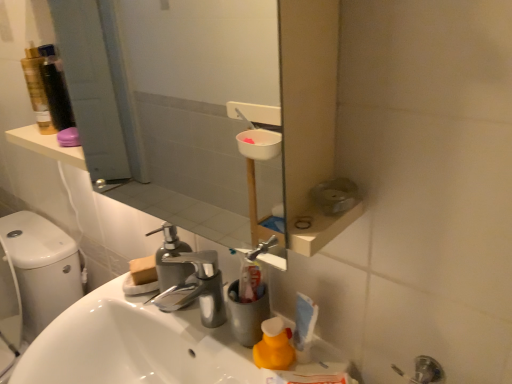
What do you see at coordinates (196, 287) in the screenshot? I see `chrome metallic faucet at center` at bounding box center [196, 287].

This screenshot has width=512, height=384. What do you see at coordinates (274, 346) in the screenshot?
I see `yellow matte cleaning product at lower center` at bounding box center [274, 346].

In order to click on chrome metallic faucet at center in this screenshot , I will do 196,287.

Does chrome metallic faucet at center lie behind white glossy sink at center?

Yes, the depth of chrome metallic faucet at center is greater than that of white glossy sink at center.

Is chrome metallic faucet at center not within white glossy sink at center?

Absolutely, chrome metallic faucet at center is external to white glossy sink at center.

You are a GUI agent. You are given a task and a screenshot of the screen. Output one action in this format:
    pyautogui.click(x=<x>, y=<y>)
    Task: Click on the tap lying above the white glossy sink at center (from the image's perspective)
    Image resolution: width=512 pixels, height=384 pixels.
    Given the screenshot: What is the action you would take?
    pyautogui.click(x=196, y=287)

Does white glossy sink at center touch chrome metallic faucet at center?

No, white glossy sink at center is not beside chrome metallic faucet at center.

Considering the positions of point (45, 382) and point (167, 299), is point (45, 382) closer or farther from the camera than point (167, 299)?

Point (45, 382) appears to be closer to the viewer than point (167, 299).

Is white glossy sink at center facing towards chrome metallic faucet at center?

No, white glossy sink at center is not facing towards chrome metallic faucet at center.

Which of these two, clear glass mirror at upper center or yellow matte cleaning product at lower center, is smaller?

With smaller size is yellow matte cleaning product at lower center.

Is point (80, 52) closer or farther from the camera than point (287, 333)?

Point (80, 52) is farther from the camera than point (287, 333).

Is clear glass mirror at upper center not within yellow matte cleaning product at lower center?

clear glass mirror at upper center lies outside yellow matte cleaning product at lower center's area.

From the image's perspective, which is below, clear glass mirror at upper center or yellow matte cleaning product at lower center?

yellow matte cleaning product at lower center.

Which object is thinner, yellow matte cleaning product at lower center or clear glass mirror at upper center?

Thinner between the two is yellow matte cleaning product at lower center.

Is yellow matte cleaning product at lower center facing away from clear glass mirror at upper center?

No, yellow matte cleaning product at lower center is not facing away from clear glass mirror at upper center.

In the scene shown: What's the angular difference between yellow matte cleaning product at lower center and clear glass mirror at upper center's facing directions?

They differ by 2.49 degrees in their facing directions.

Based on the photo, considering the sizes of objects yellow matte cleaning product at lower center and chrome metallic faucet at center in the image provided, who is smaller, yellow matte cleaning product at lower center or chrome metallic faucet at center?

yellow matte cleaning product at lower center is smaller.

Is yellow matte cleaning product at lower center turned away from chrome metallic faucet at center?

No, yellow matte cleaning product at lower center is not facing the opposite direction of chrome metallic faucet at center.

From a real-world perspective, is yellow matte cleaning product at lower center physically above chrome metallic faucet at center?

No, from a real-world perspective, yellow matte cleaning product at lower center is not on top of chrome metallic faucet at center.

Is chrome metallic faucet at center closer to camera compared to clear glass mirror at upper center?

No.

Where is `tap below the clear glass mirror at upper center (from a real-world perspective)`? This screenshot has width=512, height=384. tap below the clear glass mirror at upper center (from a real-world perspective) is located at coordinates (196, 287).

Considering the relative sizes of chrome metallic faucet at center and clear glass mirror at upper center in the image provided, is chrome metallic faucet at center smaller than clear glass mirror at upper center?

Correct, chrome metallic faucet at center occupies less space than clear glass mirror at upper center.

Choose the correct answer: Is white glossy sink at center inside yellow matte cleaning product at lower center or outside it?

white glossy sink at center is not enclosed by yellow matte cleaning product at lower center.

Between white glossy sink at center and yellow matte cleaning product at lower center, which one is positioned behind?

yellow matte cleaning product at lower center.

Can you tell me how much white glossy sink at center and yellow matte cleaning product at lower center differ in facing direction?

white glossy sink at center and yellow matte cleaning product at lower center are facing 3.47 degrees away from each other.

From the image's perspective, is white glossy sink at center located above yellow matte cleaning product at lower center?

No, from the image's perspective, white glossy sink at center is not on top of yellow matte cleaning product at lower center.

Image resolution: width=512 pixels, height=384 pixels. I want to click on sink that appears below the chrome metallic faucet at center (from a real-world perspective), so click(x=133, y=345).

Locate an element on the screen. sink lying in front of the chrome metallic faucet at center is located at coordinates (133, 345).

Based on their spatial positions, is yellow matte cleaning product at lower center or chrome metallic faucet at center further from white glossy sink at center?

The object further to white glossy sink at center is yellow matte cleaning product at lower center.

Based on their spatial positions, is chrome metallic faucet at center or yellow matte cleaning product at lower center further from clear glass mirror at upper center?

yellow matte cleaning product at lower center is further to clear glass mirror at upper center.

Which object lies nearer to the anchor point chrome metallic faucet at center, clear glass mirror at upper center or yellow matte cleaning product at lower center?

Based on the image, yellow matte cleaning product at lower center appears to be nearer to chrome metallic faucet at center.

Estimate the real-world distances between objects in this image. Which object is closer to clear glass mirror at upper center, yellow matte cleaning product at lower center or white glossy sink at center?

Based on the image, white glossy sink at center appears to be nearer to clear glass mirror at upper center.

Based on their spatial positions, is yellow matte cleaning product at lower center or clear glass mirror at upper center further from white glossy sink at center?

Among the two, clear glass mirror at upper center is located further to white glossy sink at center.

Looking at the image, which one is located further to clear glass mirror at upper center, yellow matte cleaning product at lower center or chrome metallic faucet at center?

The object further to clear glass mirror at upper center is yellow matte cleaning product at lower center.

Based on the photo, based on their spatial positions, is clear glass mirror at upper center or chrome metallic faucet at center further from white glossy sink at center?

clear glass mirror at upper center.

Based on their spatial positions, is white glossy sink at center or chrome metallic faucet at center closer to clear glass mirror at upper center?

Among the two, white glossy sink at center is located nearer to clear glass mirror at upper center.

You are a GUI agent. You are given a task and a screenshot of the screen. Output one action in this format:
    pyautogui.click(x=<x>, y=<y>)
    Task: Click on the cleaning product between clear glass mirror at upper center and white glossy sink at center from top to bottom
    The width and height of the screenshot is (512, 384).
    Given the screenshot: What is the action you would take?
    pyautogui.click(x=274, y=346)

Where is `cleaning product located between white glossy sink at center and chrome metallic faucet at center in the depth direction`? cleaning product located between white glossy sink at center and chrome metallic faucet at center in the depth direction is located at coordinates (274, 346).

Find the location of a particular element. tap between clear glass mirror at upper center and white glossy sink at center in the up-down direction is located at coordinates (196, 287).

Where is `tap between clear glass mirror at upper center and yellow matte cleaning product at lower center in the up-down direction`? tap between clear glass mirror at upper center and yellow matte cleaning product at lower center in the up-down direction is located at coordinates (196, 287).